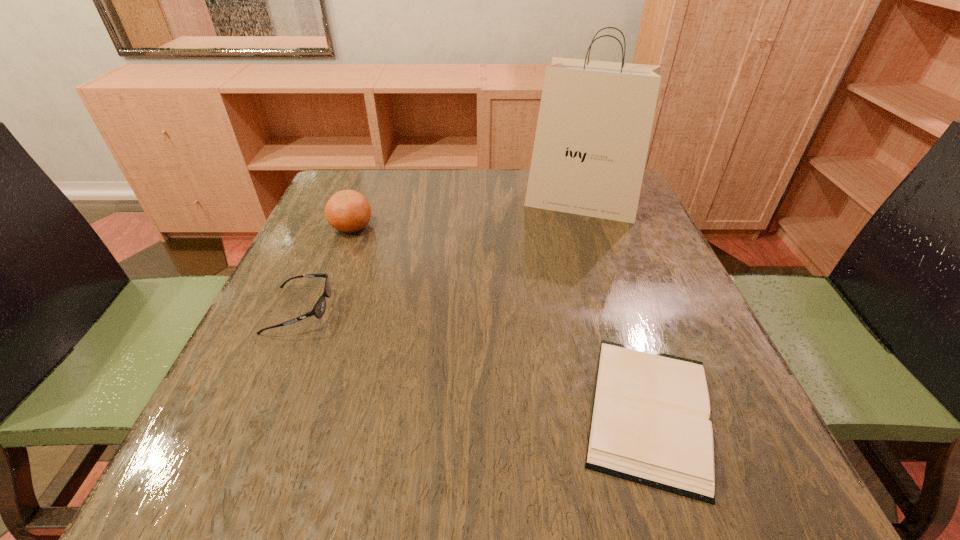
At what (x,y) coordinates should I click in order to perform the action: click on shopping bag. Please return your answer as a coordinate pair (x, y). Looking at the image, I should click on (595, 119).

I want to click on the third shortest object, so click(349, 211).

Where is `sunglasses`? sunglasses is located at coordinates (318, 310).

Where is `the third farthest object`? the third farthest object is located at coordinates (318, 310).

The height and width of the screenshot is (540, 960). In order to click on the shortest object in this screenshot , I will do `click(650, 424)`.

You are a GUI agent. You are given a task and a screenshot of the screen. Output one action in this format:
    pyautogui.click(x=<x>, y=<y>)
    Task: Click on the hardback book
    This screenshot has width=960, height=540.
    Given the screenshot: What is the action you would take?
    pos(650,424)

Locate an element on the screen. vacant space situated 0.270m on the left of the tallest object is located at coordinates (418, 202).

Where is `vacant point located 0.210m on the back of the clementine`? This screenshot has height=540, width=960. vacant point located 0.210m on the back of the clementine is located at coordinates (372, 173).

The width and height of the screenshot is (960, 540). I want to click on vacant point located on the front-facing side of the third tallest object, so click(389, 310).

The height and width of the screenshot is (540, 960). What are the coordinates of `vacant space located on the left of the hardback book` in the screenshot? It's located at (422, 410).